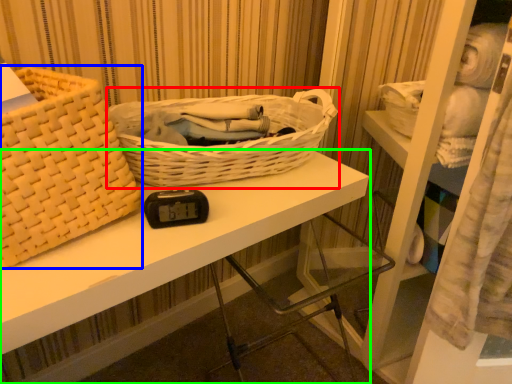
Question: Which object is positioned closest to picnic basket (highlighted by a red box)? Select from picnic basket (highlighted by a blue box) and desk (highlighted by a green box).

Choices:
 (A) picnic basket
 (B) desk

Answer: (B)